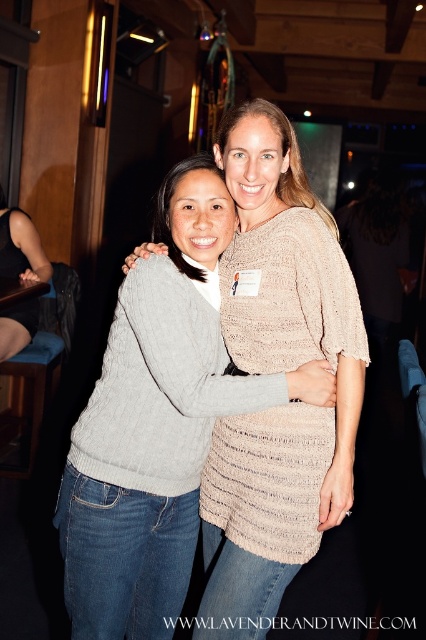
You are a fashion designer observing two gray sweaters in the image. The first is the gray knitted sweater at center, and the second is the matte gray sweater at lower left. Which of these two sweaters appears taller in the image?

The gray knitted sweater at center appears much taller than the matte gray sweater at lower left in the image.

You are a fashion designer observing two gray sweaters in the image. The gray knitted sweater at center and the matte gray sweater at lower left. Which one is closer to the bottom of the image?

The gray knitted sweater at center is positioned under the matte gray sweater at lower left, so it is closer to the bottom of the image.

What is the location of the point with coordinates (158,422) in the image?

The point with coordinates (158,422) is on the gray knitted sweater at center.